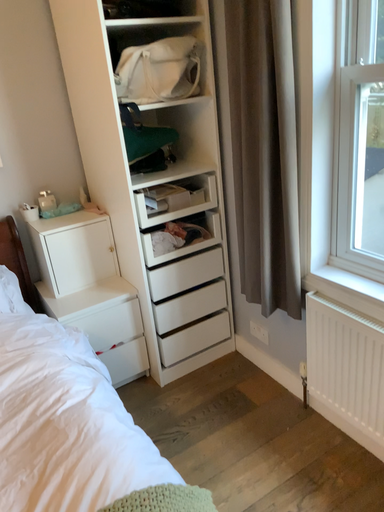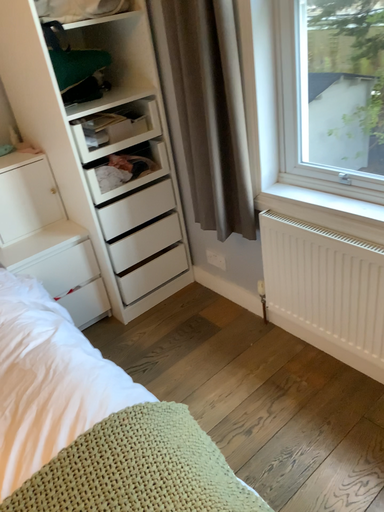
Question: How did the camera likely rotate when shooting the video?

Choices:
 (A) rotated upward
 (B) rotated downward

Answer: (B)